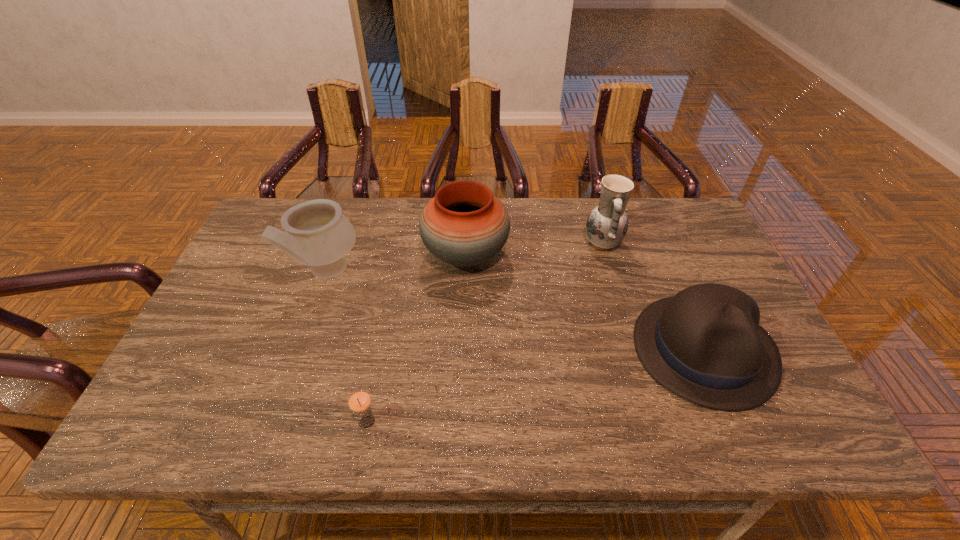
The image size is (960, 540). Identify the location of vacant area at the right edge of the desktop. (697, 264).

Where is `free space between the bowler hat and the rightmost pottery`? free space between the bowler hat and the rightmost pottery is located at coordinates 653,296.

At what (x,y) coordinates should I click in order to perform the action: click on vacant region between the second pottery from right to left and the second shortest object. Please return your answer as a coordinate pair (x, y). The image size is (960, 540). Looking at the image, I should click on (585, 303).

What are the coordinates of `vacant area that lies between the rightmost pottery and the second pottery from right to left` in the screenshot? It's located at (534, 249).

Where is `empty location between the fourth tallest object and the third object from left to right`? The height and width of the screenshot is (540, 960). empty location between the fourth tallest object and the third object from left to right is located at coordinates (585, 303).

Where is `free area in between the second pottery from left to right and the fourth tallest object`? The image size is (960, 540). free area in between the second pottery from left to right and the fourth tallest object is located at coordinates (585, 303).

Locate an element on the screen. This screenshot has width=960, height=540. vacant space in between the second object from left to right and the leftmost pottery is located at coordinates (347, 347).

Where is `empty space that is in between the rightmost pottery and the shortest object`? empty space that is in between the rightmost pottery and the shortest object is located at coordinates (485, 333).

Where is `empty space that is in between the straw and the third object from right to left`? This screenshot has height=540, width=960. empty space that is in between the straw and the third object from right to left is located at coordinates (416, 339).

Choose which object is the nearest neighbor to the shortest object. Please provide its 2D coordinates. Your answer should be formatted as a tuple, i.e. [(x, y)], where the tuple contains the x and y coordinates of a point satisfying the conditions above.

[(317, 234)]